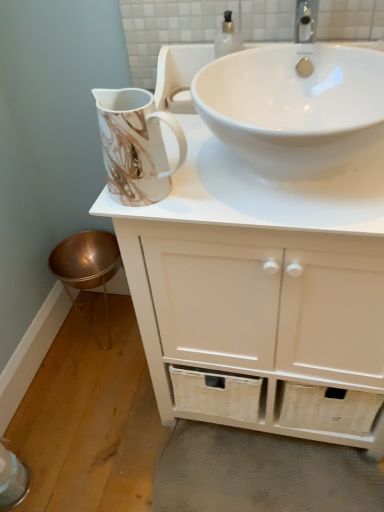
Question: Could you tell me if marble-patterned ceramic jug at upper left is facing white glossy sink at upper center?

Choices:
 (A) no
 (B) yes

Answer: (A)

Question: From the image's perspective, does marble-patterned ceramic jug at upper left appear higher than white glossy sink at upper center?

Choices:
 (A) yes
 (B) no

Answer: (B)

Question: Does marble-patterned ceramic jug at upper left appear on the right side of white glossy sink at upper center?

Choices:
 (A) yes
 (B) no

Answer: (B)

Question: From a real-world perspective, is marble-patterned ceramic jug at upper left on white glossy sink at upper center?

Choices:
 (A) yes
 (B) no

Answer: (A)

Question: Does marble-patterned ceramic jug at upper left have a greater height compared to white glossy sink at upper center?

Choices:
 (A) no
 (B) yes

Answer: (B)

Question: Is marble-patterned ceramic jug at upper left thinner than white glossy sink at upper center?

Choices:
 (A) no
 (B) yes

Answer: (B)

Question: Are white glossy sink at upper center and gray woven bath mat at lower center far apart?

Choices:
 (A) no
 (B) yes

Answer: (A)

Question: Is white glossy sink at upper center smaller than gray woven bath mat at lower center?

Choices:
 (A) no
 (B) yes

Answer: (A)

Question: Does white glossy sink at upper center turn towards gray woven bath mat at lower center?

Choices:
 (A) yes
 (B) no

Answer: (B)

Question: Considering the relative positions of white glossy sink at upper center and gray woven bath mat at lower center in the image provided, is white glossy sink at upper center to the left of gray woven bath mat at lower center from the viewer's perspective?

Choices:
 (A) yes
 (B) no

Answer: (A)

Question: Is the depth of white glossy sink at upper center greater than that of gray woven bath mat at lower center?

Choices:
 (A) no
 (B) yes

Answer: (A)

Question: Does white glossy sink at upper center have a larger size compared to gray woven bath mat at lower center?

Choices:
 (A) yes
 (B) no

Answer: (A)

Question: Considering the relative sizes of marble-patterned ceramic jug at upper left and white matte cabinet at upper center in the image provided, is marble-patterned ceramic jug at upper left shorter than white matte cabinet at upper center?

Choices:
 (A) yes
 (B) no

Answer: (A)